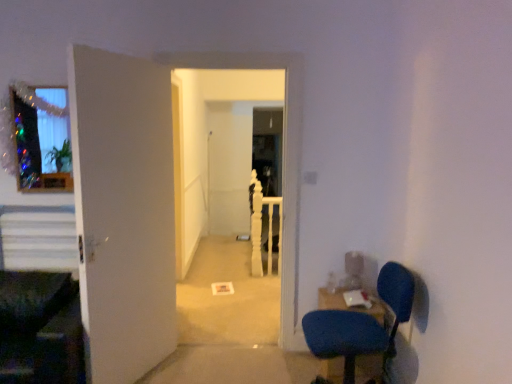
Image resolution: width=512 pixels, height=384 pixels. What are the coordinates of `vacant point above translucent glass window at upper left (from a real-world perspective)` in the screenshot? It's located at (34, 77).